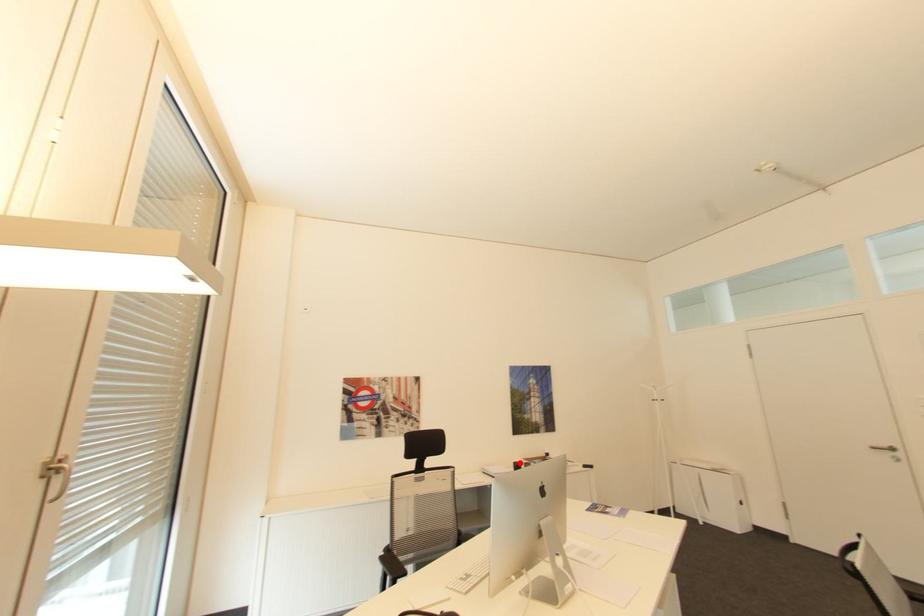
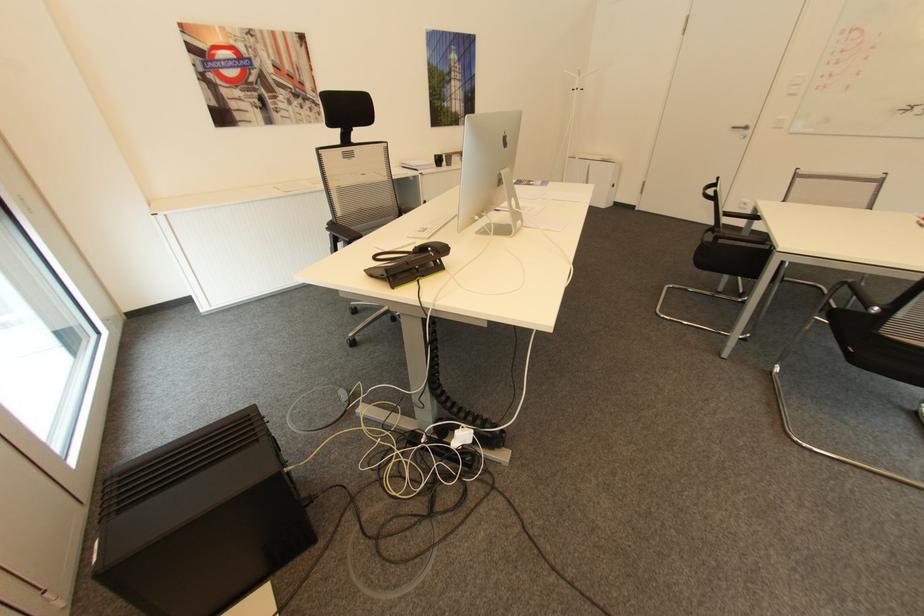
Find the pixel in the second image that matches the highlighted location in the first image.

(441, 155)